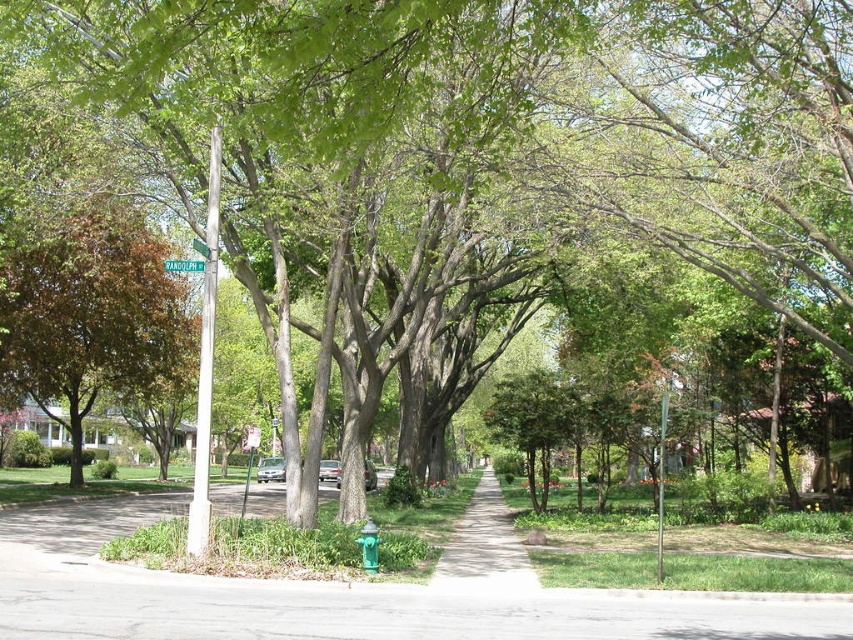
Question: Considering the real-world distances, which object is closest to the gray asphalt pavement at center?

Choices:
 (A) concrete sidewalk at center
 (B) green plastic street sign at upper center

Answer: (A)

Question: Is gray asphalt pavement at center below concrete sidewalk at center?

Choices:
 (A) no
 (B) yes

Answer: (A)

Question: Where is gray asphalt pavement at center located in relation to brown leafy tree at left in the image?

Choices:
 (A) below
 (B) above

Answer: (A)

Question: Which object appears farthest from the camera in this image?

Choices:
 (A) brown leafy tree at left
 (B) green plastic street sign at upper center
 (C) gray asphalt pavement at center

Answer: (A)

Question: Is gray asphalt pavement at center above concrete sidewalk at center?

Choices:
 (A) yes
 (B) no

Answer: (A)

Question: Which point is closer to the camera?

Choices:
 (A) (91, 384)
 (B) (173, 262)
 (C) (496, 547)

Answer: (B)